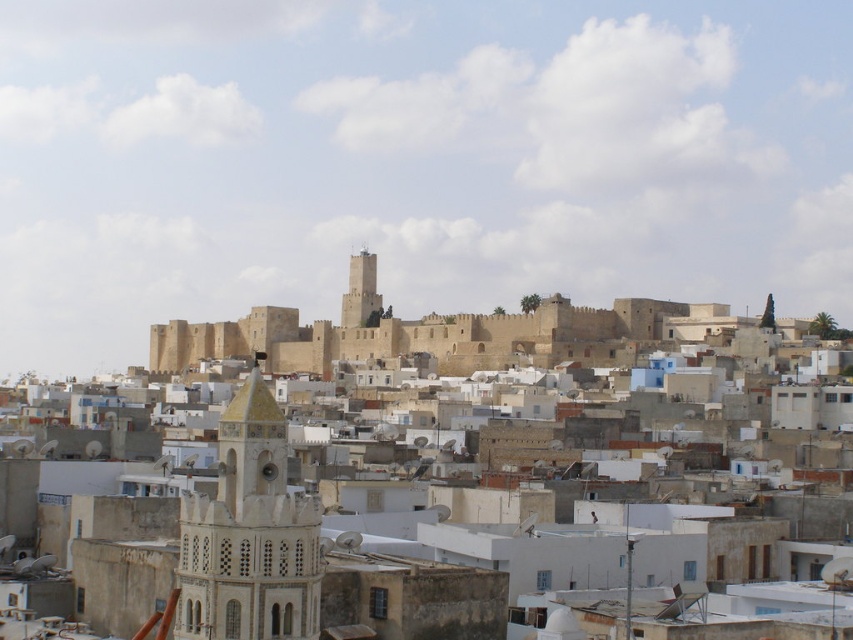
You are standing at the point labeled as point (323, 529) in the cityscape. Looking around, you see the beige stone town at center and the fortress in the background. Which direction should you face to see the fortress?

The fortress is in the background, so facing towards it from the beige stone town at center would mean looking towards the background direction. Since the point corresponds to the beige stone town at center, you should face towards the background direction to see the fortress.

You are a drone operator tasked with capturing aerial footage of the city. Your drone has a maximum flight range of 50 meters. If you are positioned at the white stucco tower at center, can you fly your drone to the light brown stone tower at center without exceeding its range?

The white stucco tower at center is 44.04 meters away from the light brown stone tower at center. Since the drone has a maximum flight range of 50 meters, it can safely reach the light brown stone tower at center without exceeding its range.